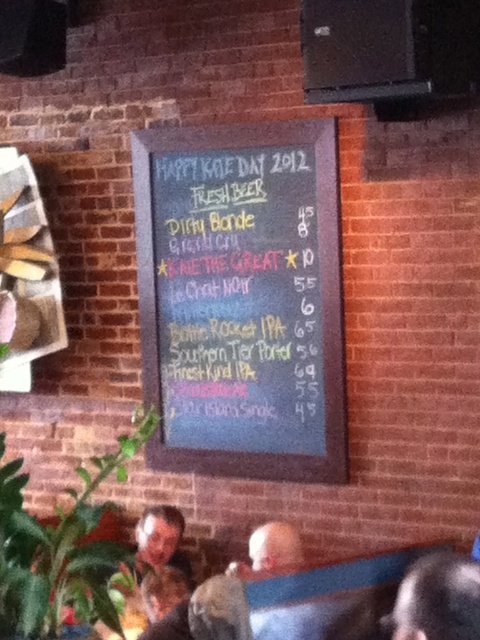
You are standing in a casual dining area and notice a black chalkboard at center. If you were to walk directly towards it from the entrance, which direction should you move relative to your current position?

Since the black chalkboard at center is positioned at point 0.467 on the x and 0.504 on the y, moving directly towards it would require walking straight ahead as it is centrally located in the scene.

You are standing in front of the chalkboard menu and want to point to the two specific points mentioned. Which point is closer to you, point (416, 624) or point (287, 538)?

Point (416, 624) is closer to the viewer than point (287, 538).

You are standing in a pub and want to read the prices of the beers listed on the black chalkboard at center. There is a gray fabric shirt at lower center in your way. Can you still see the prices clearly?

The black chalkboard at center is further to the viewer than the gray fabric shirt at lower center, so the shirt is closer to you. This means the shirt might block your view of the chalkboard, making it harder to see the prices clearly.